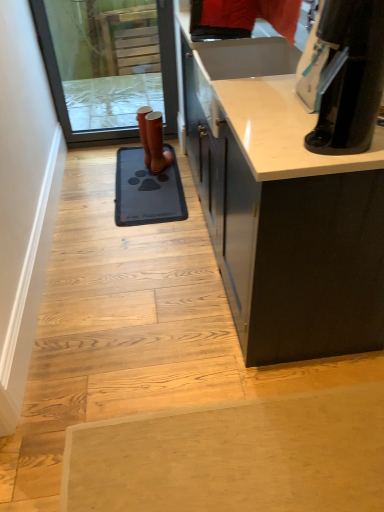
You are a GUI agent. You are given a task and a screenshot of the screen. Output one action in this format:
    pyautogui.click(x=<x>, y=<y>)
    Task: Click on the free space to the left of brown leather boot at center
    The image size is (384, 512).
    Given the screenshot: What is the action you would take?
    pyautogui.click(x=137, y=167)